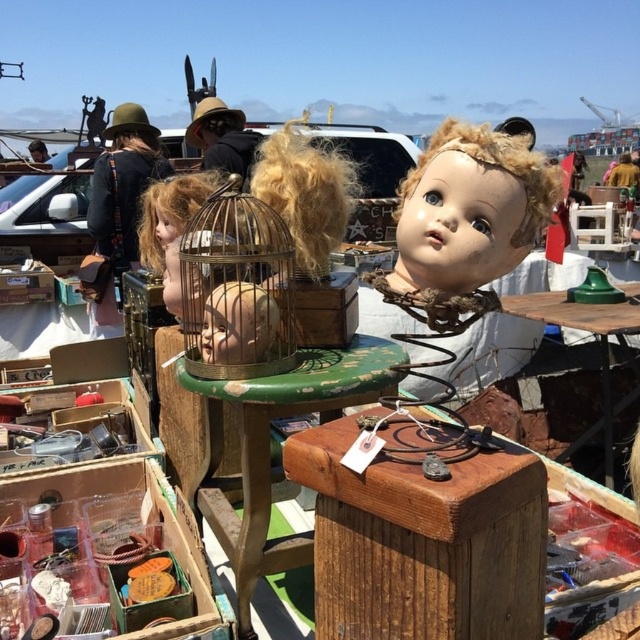
Is green painted wood table at center further to the viewer compared to gold wire birdcage at center?

Yes.

The height and width of the screenshot is (640, 640). What do you see at coordinates (269, 448) in the screenshot? I see `green painted wood table at center` at bounding box center [269, 448].

Find the location of a particular element. The width and height of the screenshot is (640, 640). green painted wood table at center is located at coordinates (269, 448).

Consider the image. Between gold wire birdcage at center and wooden table at center, which one is positioned lower?

wooden table at center is below.

Between gold wire birdcage at center and wooden table at center, which one appears on the left side from the viewer's perspective?

gold wire birdcage at center is more to the left.

Where is `gold wire birdcage at center`? gold wire birdcage at center is located at coordinates (236, 289).

Where is `matte plastic doll head at upper right`? The image size is (640, 640). matte plastic doll head at upper right is located at coordinates (468, 211).

Is the position of matte plastic doll head at upper right less distant than that of green painted wood table at center?

Yes, it is.

At what (x,y) coordinates should I click in order to perform the action: click on matte plastic doll head at upper right. Please return your answer as a coordinate pair (x, y). The height and width of the screenshot is (640, 640). Looking at the image, I should click on (468, 211).